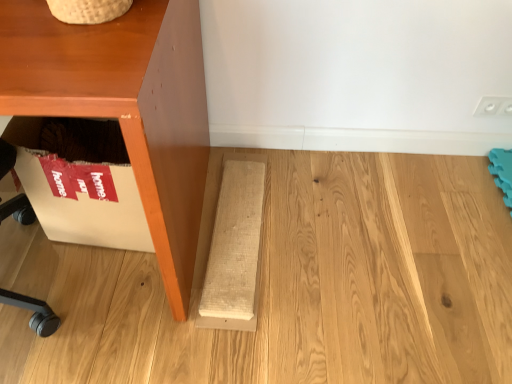
Where is `matte brown cabinet at left`? Image resolution: width=512 pixels, height=384 pixels. matte brown cabinet at left is located at coordinates (125, 106).

Describe the element at coordinates (125, 106) in the screenshot. I see `matte brown cabinet at left` at that location.

What is the approximate height of matte brown cabinet at left?

matte brown cabinet at left is 29.31 inches in height.

This screenshot has height=384, width=512. Describe the element at coordinates (234, 247) in the screenshot. I see `natural wood plank at lower center` at that location.

The width and height of the screenshot is (512, 384). I want to click on natural wood plank at lower center, so click(234, 247).

The image size is (512, 384). I want to click on matte brown cabinet at left, so click(125, 106).

Is matte brown cabinet at left at the left side of natural wood plank at lower center?

Correct, you'll find matte brown cabinet at left to the left of natural wood plank at lower center.

Relative to natural wood plank at lower center, is matte brown cabinet at left in front or behind?

Visually, matte brown cabinet at left is located in front of natural wood plank at lower center.

Between point (204, 105) and point (246, 219), which one is positioned behind?

Point (204, 105)

From the image's perspective, which one is positioned higher, matte brown cabinet at left or natural wood plank at lower center?

From the image's view, matte brown cabinet at left is above.

From a real-world perspective, is matte brown cabinet at left under natural wood plank at lower center?

No, from a real-world perspective, matte brown cabinet at left is not beneath natural wood plank at lower center.

Which object is wider, matte brown cabinet at left or natural wood plank at lower center?

Wider between the two is matte brown cabinet at left.

Considering the sizes of objects matte brown cabinet at left and natural wood plank at lower center in the image provided, who is taller, matte brown cabinet at left or natural wood plank at lower center?

With more height is matte brown cabinet at left.

Between matte brown cabinet at left and natural wood plank at lower center, which one has larger size?

Bigger between the two is matte brown cabinet at left.

Is natural wood plank at lower center located within matte brown cabinet at left?

No, natural wood plank at lower center is located outside of matte brown cabinet at left.

Are matte brown cabinet at left and natural wood plank at lower center far apart?

No, matte brown cabinet at left is not far from natural wood plank at lower center.

Is matte brown cabinet at left looking in the opposite direction of natural wood plank at lower center?

No, natural wood plank at lower center is not at the back of matte brown cabinet at left.

What's the angular difference between matte brown cabinet at left and natural wood plank at lower center's facing directions?

matte brown cabinet at left and natural wood plank at lower center are facing 4 degrees away from each other.

Measure the distance from matte brown cabinet at left to natural wood plank at lower center.

matte brown cabinet at left is 15.73 inches away from natural wood plank at lower center.

At what (x,y) coordinates should I click in order to perform the action: click on plank on the right of matte brown cabinet at left. Please return your answer as a coordinate pair (x, y). The width and height of the screenshot is (512, 384). Looking at the image, I should click on (234, 247).

Which is more to the left, natural wood plank at lower center or matte brown cabinet at left?

matte brown cabinet at left.

In the scene shown: Relative to matte brown cabinet at left, is natural wood plank at lower center in front or behind?

In the image, natural wood plank at lower center appears behind matte brown cabinet at left.

Which is behind, point (223, 227) or point (195, 187)?

The point (223, 227) is more distant.

From the image's perspective, is natural wood plank at lower center above matte brown cabinet at left?

Incorrect, from the image's perspective, natural wood plank at lower center is lower than matte brown cabinet at left.

From a real-world perspective, does natural wood plank at lower center sit lower than matte brown cabinet at left?

Yes.

Which of these two, natural wood plank at lower center or matte brown cabinet at left, is wider?

matte brown cabinet at left is wider.

Is natural wood plank at lower center taller than matte brown cabinet at left?

In fact, natural wood plank at lower center may be shorter than matte brown cabinet at left.

In the scene shown: Based on their sizes in the image, would you say natural wood plank at lower center is bigger or smaller than matte brown cabinet at left?

Clearly, natural wood plank at lower center is smaller in size than matte brown cabinet at left.

Is natural wood plank at lower center positioned beyond the bounds of matte brown cabinet at left?

natural wood plank at lower center lies outside matte brown cabinet at left's area.

Does natural wood plank at lower center touch matte brown cabinet at left?

There is a gap between natural wood plank at lower center and matte brown cabinet at left.

Is natural wood plank at lower center positioned with its back to matte brown cabinet at left?

natural wood plank at lower center does not have its back to matte brown cabinet at left.

Based on the photo, can you tell me how much natural wood plank at lower center and matte brown cabinet at left differ in facing direction?

4 degrees separate the facing orientations of natural wood plank at lower center and matte brown cabinet at left.

The width and height of the screenshot is (512, 384). What are the coordinates of `plank below the matte brown cabinet at left (from a real-world perspective)` in the screenshot? It's located at (234, 247).

This screenshot has height=384, width=512. Find the location of `plank lying on the right of matte brown cabinet at left`. plank lying on the right of matte brown cabinet at left is located at coordinates (234, 247).

The image size is (512, 384). There is a natural wood plank at lower center. What are the coordinates of `furniture above it (from a real-world perspective)` in the screenshot? It's located at (125, 106).